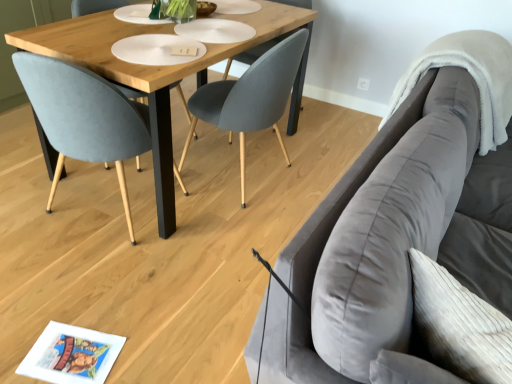
Where is `vacant space in front of wooden table at center`? vacant space in front of wooden table at center is located at coordinates (131, 288).